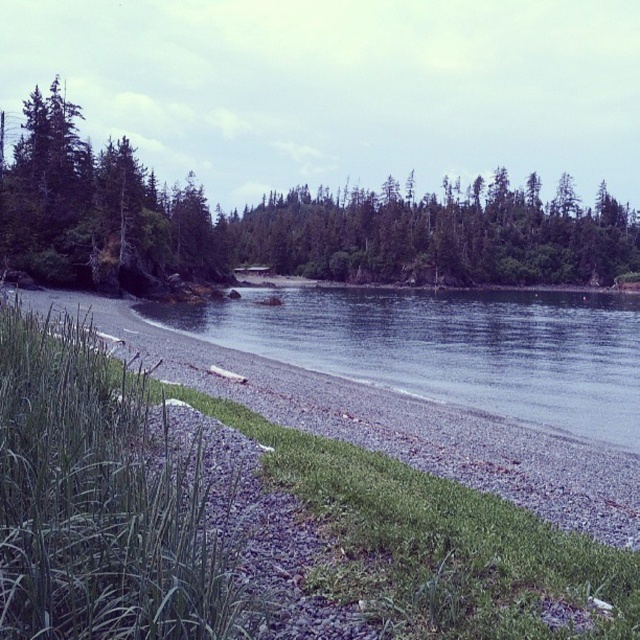
Who is lower down, green matte tree at upper left or clear water at center?

clear water at center is below.

Consider the image. Can you confirm if green matte tree at upper left is shorter than clear water at center?

No.

Locate an element on the screen. green matte tree at upper left is located at coordinates (282, 225).

How distant is green matte tree at upper left from green matte trees at center?

The distance of green matte tree at upper left from green matte trees at center is 4.31 meters.

Can you confirm if green matte tree at upper left is wider than green matte trees at center?

Indeed, green matte tree at upper left has a greater width compared to green matte trees at center.

Is point (220, 273) closer to camera compared to point (497, 225)?

Yes, it is in front of point (497, 225).

Locate an element on the screen. green matte tree at upper left is located at coordinates (282, 225).

Does clear water at center have a greater height compared to green matte trees at center?

In fact, clear water at center may be shorter than green matte trees at center.

Who is more distant from viewer, (534, 296) or (609, 252)?

Point (609, 252)

I want to click on clear water at center, so click(x=449, y=348).